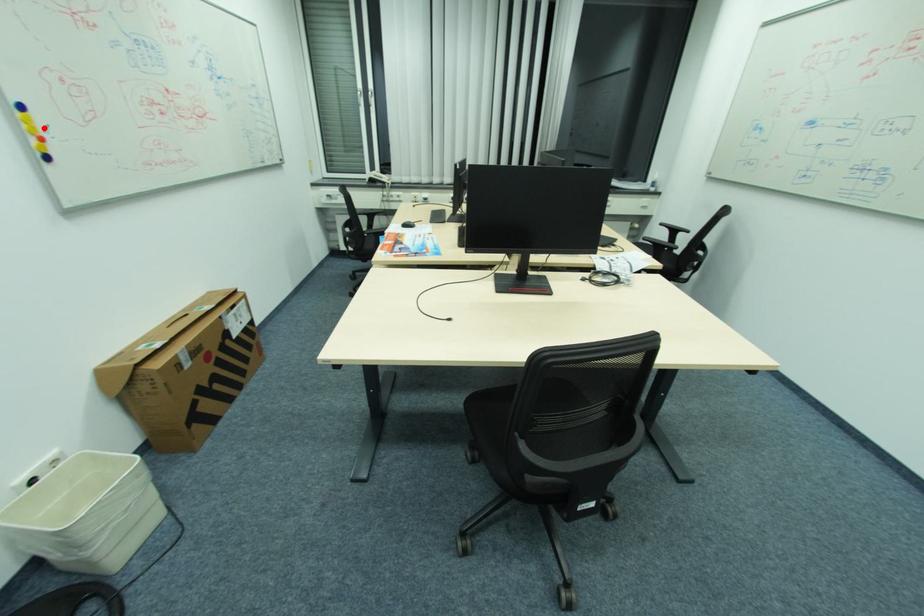
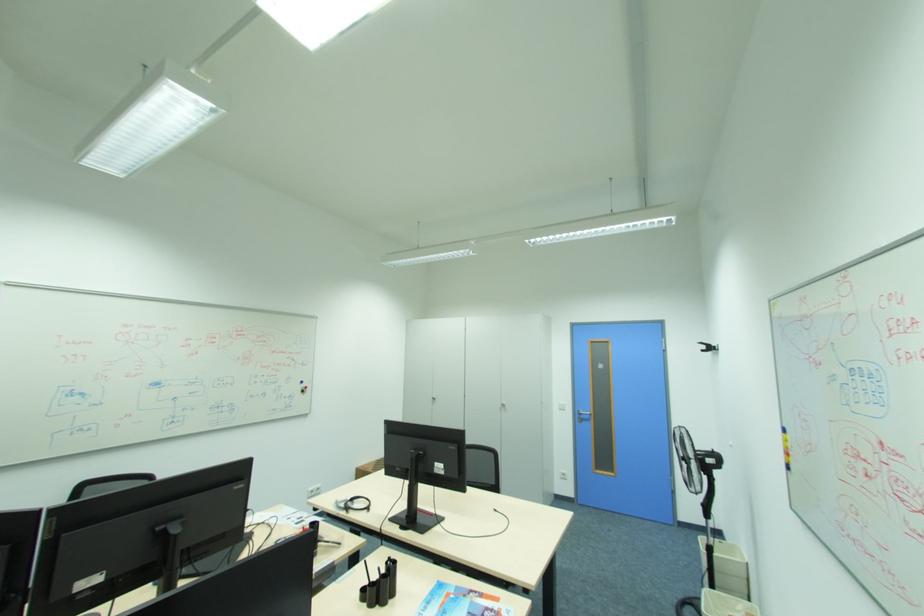
Where in the second image is the point corresponding to the highlighted location from the first image?

(794, 446)